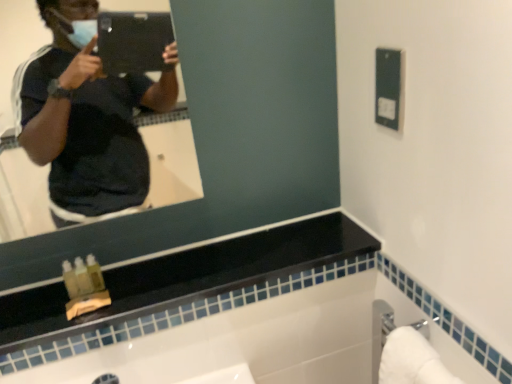
Question: Is black glossy counter top at upper center oriented towards silver metallic towel bar at lower right?

Choices:
 (A) yes
 (B) no

Answer: (B)

Question: Is black glossy counter top at upper center wider than silver metallic towel bar at lower right?

Choices:
 (A) no
 (B) yes

Answer: (B)

Question: Considering the relative positions of black glossy counter top at upper center and silver metallic towel bar at lower right in the image provided, is black glossy counter top at upper center to the right of silver metallic towel bar at lower right from the viewer's perspective?

Choices:
 (A) yes
 (B) no

Answer: (B)

Question: Is black glossy counter top at upper center further to the viewer compared to silver metallic towel bar at lower right?

Choices:
 (A) no
 (B) yes

Answer: (B)

Question: Is black glossy counter top at upper center in contact with silver metallic towel bar at lower right?

Choices:
 (A) no
 (B) yes

Answer: (A)

Question: Can you confirm if black glossy counter top at upper center is taller than silver metallic towel bar at lower right?

Choices:
 (A) yes
 (B) no

Answer: (B)

Question: Considering the relative sizes of silver metallic towel bar at lower right and black glossy counter top at upper center in the image provided, is silver metallic towel bar at lower right smaller than black glossy counter top at upper center?

Choices:
 (A) no
 (B) yes

Answer: (B)

Question: Considering the relative positions of silver metallic towel bar at lower right and black glossy counter top at upper center in the image provided, is silver metallic towel bar at lower right behind black glossy counter top at upper center?

Choices:
 (A) no
 (B) yes

Answer: (A)

Question: Can you confirm if silver metallic towel bar at lower right is shorter than black glossy counter top at upper center?

Choices:
 (A) no
 (B) yes

Answer: (A)

Question: Is silver metallic towel bar at lower right at the left side of black glossy counter top at upper center?

Choices:
 (A) yes
 (B) no

Answer: (B)

Question: From a real-world perspective, is silver metallic towel bar at lower right on top of black glossy counter top at upper center?

Choices:
 (A) yes
 (B) no

Answer: (B)

Question: Considering the relative sizes of silver metallic towel bar at lower right and black glossy counter top at upper center in the image provided, is silver metallic towel bar at lower right wider than black glossy counter top at upper center?

Choices:
 (A) yes
 (B) no

Answer: (B)

Question: Considering the positions of point (40, 299) and point (397, 342), is point (40, 299) closer or farther from the camera than point (397, 342)?

Choices:
 (A) closer
 (B) farther

Answer: (B)